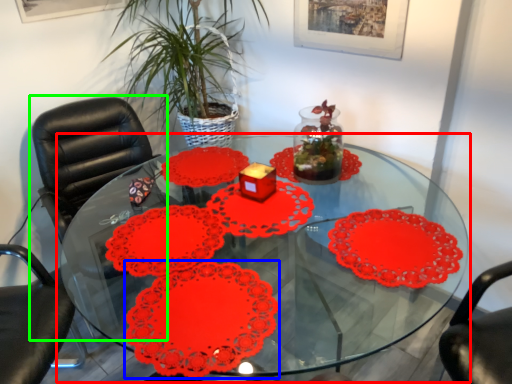
Question: Which object is the closest to the table (highlighted by a red box)? Choose among these: flower (highlighted by a blue box) or chair (highlighted by a green box).

Choices:
 (A) flower
 (B) chair

Answer: (A)